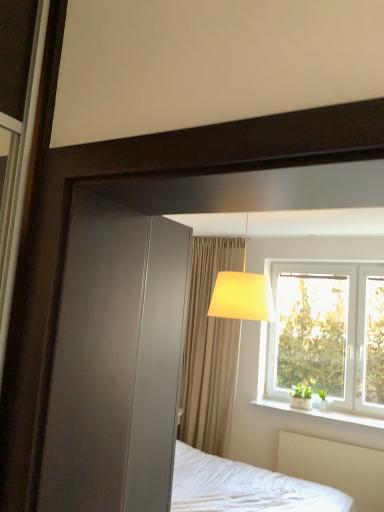
Question: From a real-world perspective, is beige fabric curtain at center on top of white textured radiator at lower right?

Choices:
 (A) yes
 (B) no

Answer: (A)

Question: Considering the relative positions of beige fabric curtain at center and white textured radiator at lower right in the image provided, is beige fabric curtain at center to the right of white textured radiator at lower right from the viewer's perspective?

Choices:
 (A) no
 (B) yes

Answer: (A)

Question: Considering the relative sizes of beige fabric curtain at center and white textured radiator at lower right in the image provided, is beige fabric curtain at center thinner than white textured radiator at lower right?

Choices:
 (A) yes
 (B) no

Answer: (B)

Question: Is beige fabric curtain at center touching white textured radiator at lower right?

Choices:
 (A) no
 (B) yes

Answer: (A)

Question: Is beige fabric curtain at center in front of white textured radiator at lower right?

Choices:
 (A) no
 (B) yes

Answer: (A)

Question: In terms of size, does white textured radiator at lower right appear bigger or smaller than white plastic window at upper right?

Choices:
 (A) big
 (B) small

Answer: (B)

Question: From a real-world perspective, is white textured radiator at lower right physically located above or below white plastic window at upper right?

Choices:
 (A) below
 (B) above

Answer: (A)

Question: Considering the positions of white textured radiator at lower right and white plastic window at upper right in the image, is white textured radiator at lower right taller or shorter than white plastic window at upper right?

Choices:
 (A) short
 (B) tall

Answer: (A)

Question: Looking at their shapes, would you say white textured radiator at lower right is wider or thinner than white plastic window at upper right?

Choices:
 (A) thin
 (B) wide

Answer: (B)

Question: Is point (370, 411) closer or farther from the camera than point (264, 399)?

Choices:
 (A) closer
 (B) farther

Answer: (A)

Question: From a real-world perspective, relative to white ceramic window sill at lower right, is white plastic window at upper right vertically above or below?

Choices:
 (A) above
 (B) below

Answer: (A)

Question: Considering their positions, is white plastic window at upper right located in front of or behind white ceramic window sill at lower right?

Choices:
 (A) front
 (B) behind

Answer: (B)

Question: Based on their positions, is white plastic window at upper right located to the left or right of white ceramic window sill at lower right?

Choices:
 (A) left
 (B) right

Answer: (B)

Question: In the image, is white ceramic window sill at lower right positioned in front of or behind matte yellow fabric lampshade at upper center?

Choices:
 (A) front
 (B) behind

Answer: (B)

Question: Is white ceramic window sill at lower right taller or shorter than matte yellow fabric lampshade at upper center?

Choices:
 (A) tall
 (B) short

Answer: (B)